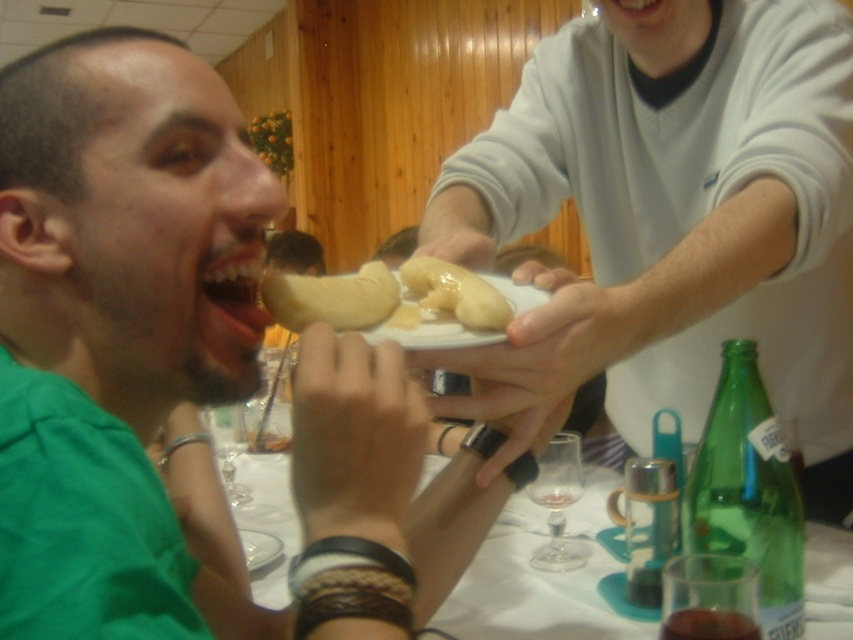
From the picture: You are at a party and want to grab the dessert from the plate being offered. The plate is located at point (x=769, y=372). If your hand can reach up to 3 feet, will you be able to reach the dessert?

The point (x=769, y=372) is 3.61 feet from the viewer. Since your hand can only reach up to 3 feet, you will not be able to reach the dessert.